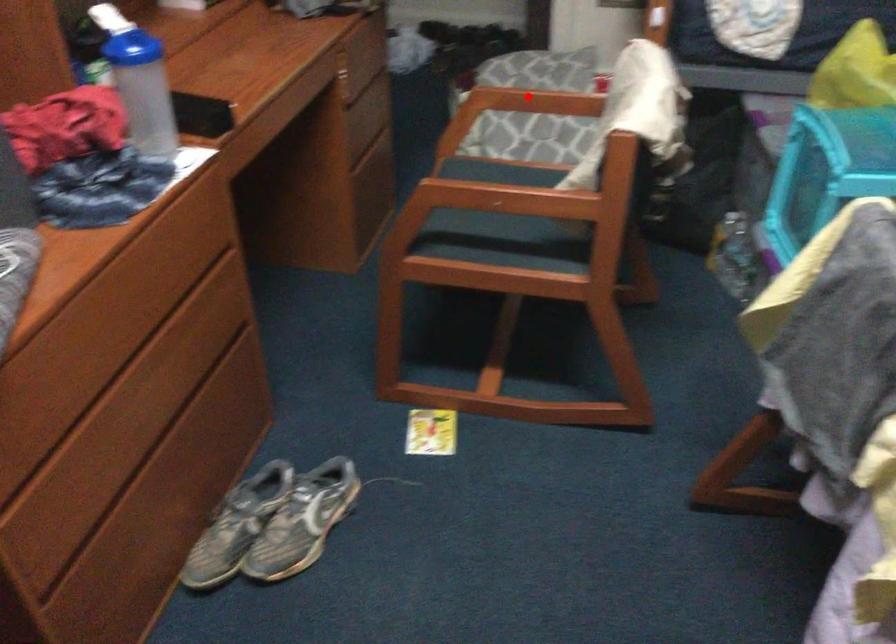
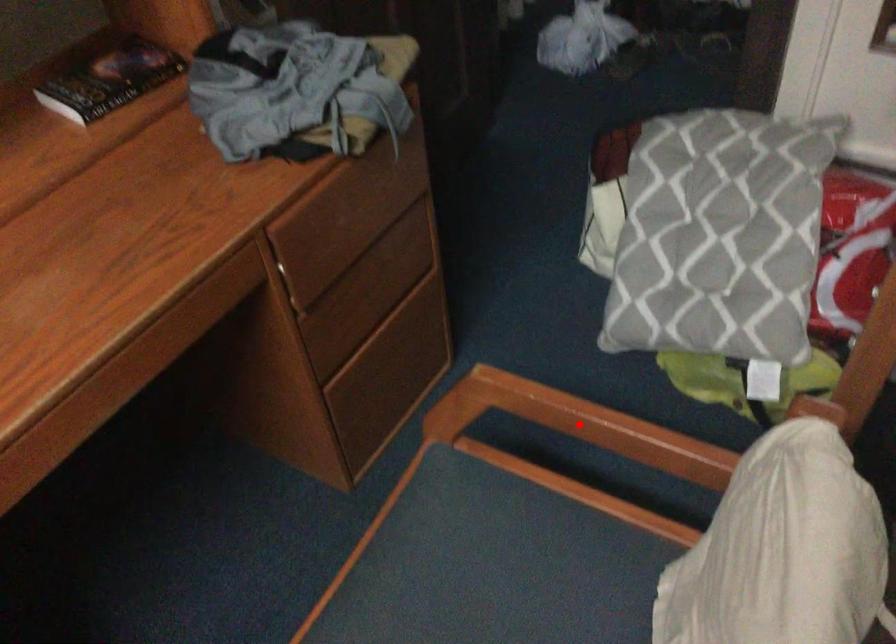
I am providing you with two images of the same scene from different viewpoints. A red point is marked on the first image and another point is marked on the second image. Do the highlighted points in image1 and image2 indicate the same real-world spot?

Yes